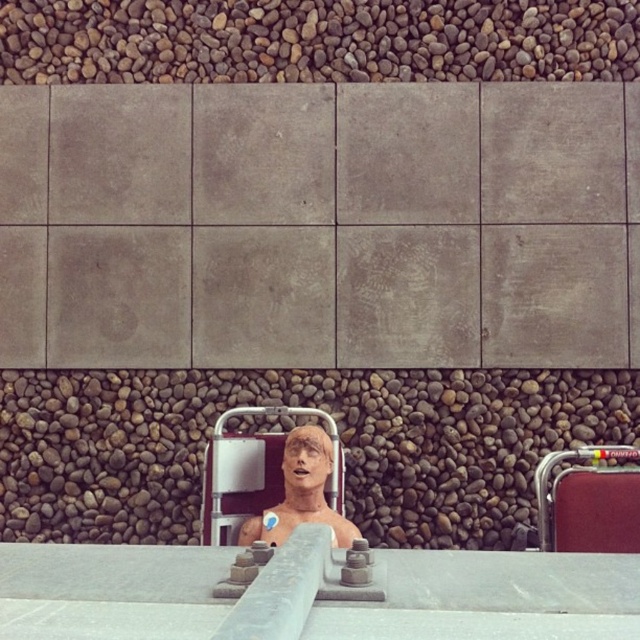
Is brown rough stone at center positioned in front of smooth beige mannequin at center?

That is False.

Where is `brown rough stone at center`? brown rough stone at center is located at coordinates (300, 404).

Identify the location of brown rough stone at center. The height and width of the screenshot is (640, 640). (300, 404).